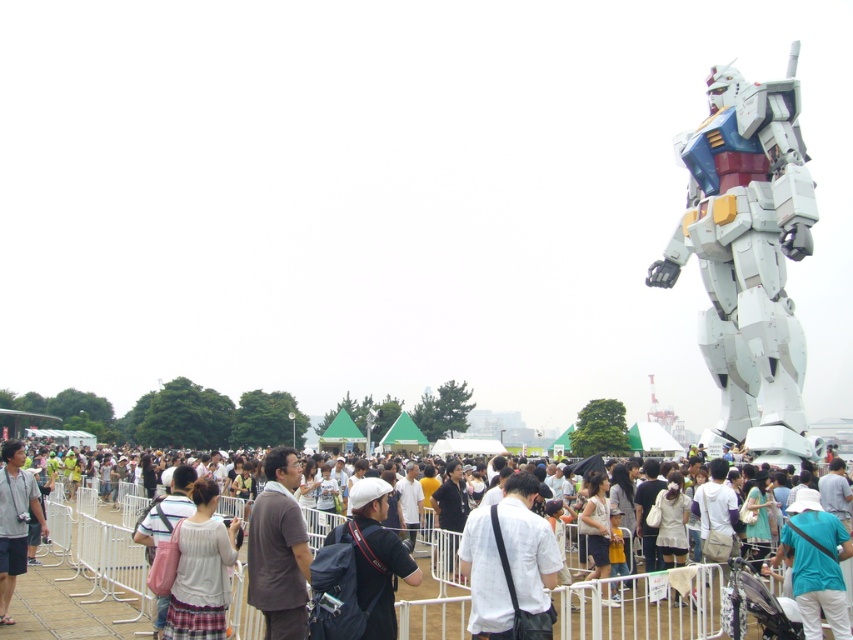
Question: Based on their relative distances, which object is farther from the white cotton shirt at center?

Choices:
 (A) teal fabric shirt at lower right
 (B) white matte cap at center
 (C) white metallic robot at upper right
 (D) matte black camera at lower left

Answer: (C)

Question: Can you confirm if white metallic robot at upper right is bigger than light gray fabric shirt at lower left?

Choices:
 (A) no
 (B) yes

Answer: (B)

Question: Which of the following is the farthest from the observer?

Choices:
 (A) (459, 627)
 (B) (24, 532)
 (C) (364, 632)

Answer: (B)

Question: From the image, what is the correct spatial relationship of white matte cap at center in relation to matte black camera at lower left?

Choices:
 (A) left
 (B) right

Answer: (B)

Question: Which of the following is the closest to the observer?

Choices:
 (A) brown matte shirt at center
 (B) white matte shirt at center
 (C) light gray fabric shirt at lower left

Answer: (B)

Question: Does white metallic robot at upper right have a lesser width compared to brown matte shirt at center?

Choices:
 (A) yes
 (B) no

Answer: (A)